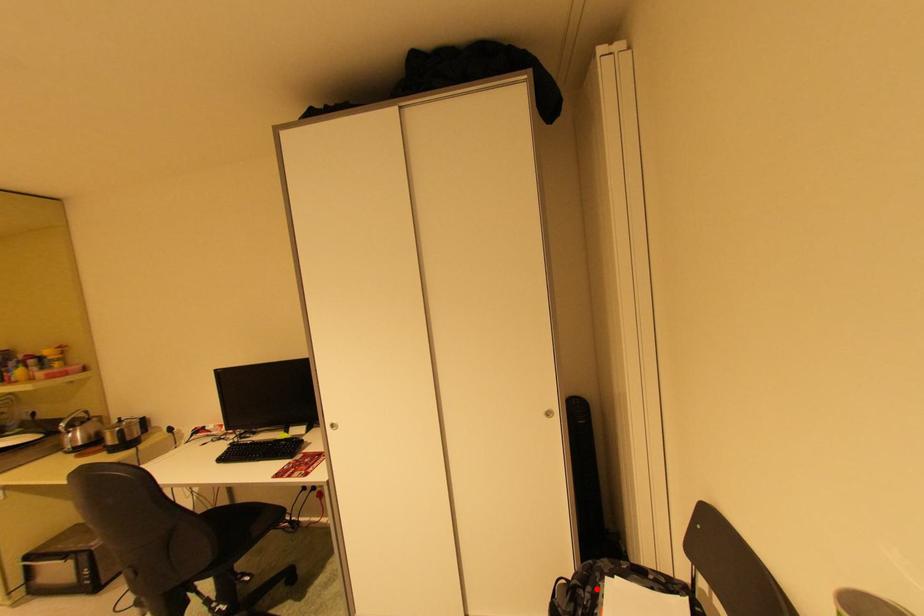
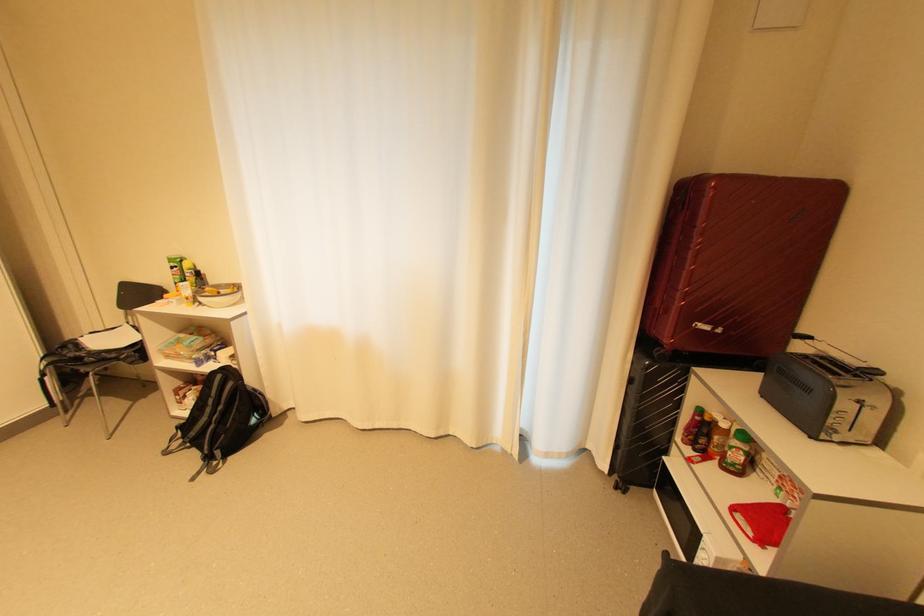
Find the pixel in the second image that matches the highlighted location in the first image.

(79, 346)